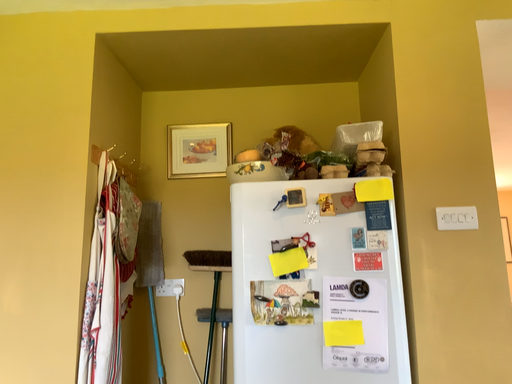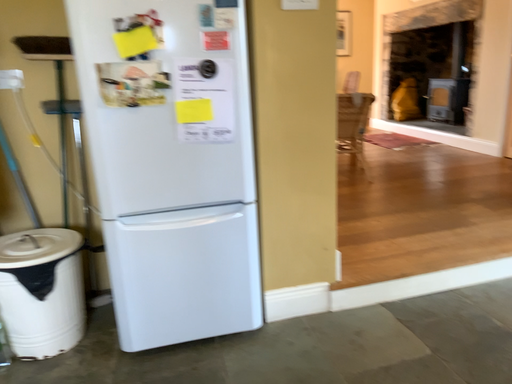
Question: How did the camera likely rotate when shooting the video?

Choices:
 (A) rotated right
 (B) rotated left

Answer: (A)